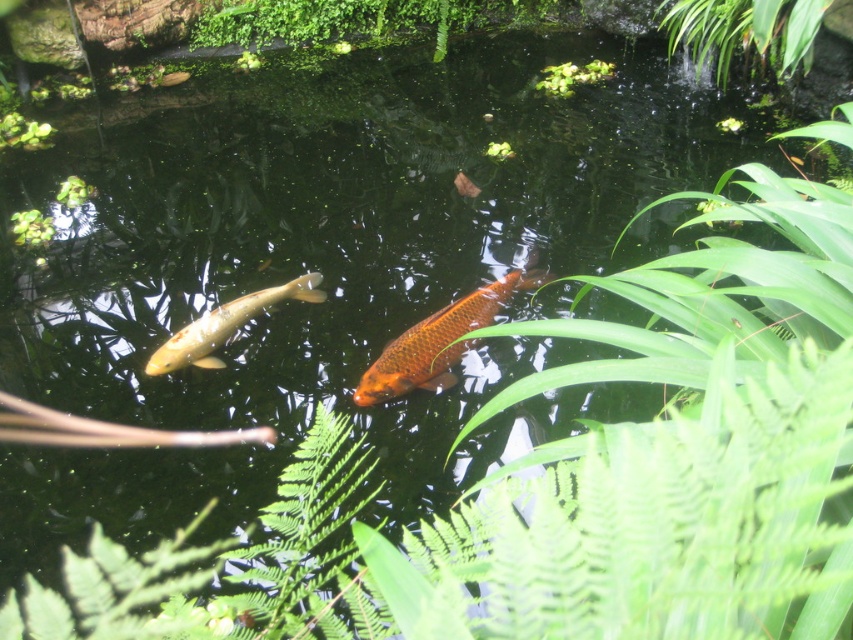
In the scene shown: Is green leafy plant at upper right positioned at the back of shiny orange fish at center?

Yes, green leafy plant at upper right is behind shiny orange fish at center.

Between green leafy plant at upper right and shiny orange fish at center, which one is positioned higher?

green leafy plant at upper right

Who is more forward, (811, 4) or (445, 364)?

Point (445, 364)

Locate an element on the screen. The image size is (853, 640). green leafy plant at upper right is located at coordinates (744, 33).

In the scene shown: Between green leafy plant at upper right and golden glossy fish at center, which one appears on the right side from the viewer's perspective?

From the viewer's perspective, green leafy plant at upper right appears more on the right side.

Between green leafy plant at upper right and golden glossy fish at center, which one is positioned lower?

golden glossy fish at center is below.

Image resolution: width=853 pixels, height=640 pixels. Identify the location of green leafy plant at upper right. (744, 33).

Is green mossy rock at upper center wider than green leafy plant at upper center?

Yes, green mossy rock at upper center is wider than green leafy plant at upper center.

From the picture: Does green mossy rock at upper center appear on the right side of green leafy plant at upper center?

In fact, green mossy rock at upper center is to the left of green leafy plant at upper center.

Which is behind, point (202, 16) or point (561, 84)?

Positioned behind is point (202, 16).

Identify the location of green mossy rock at upper center. The image size is (853, 640). (363, 19).